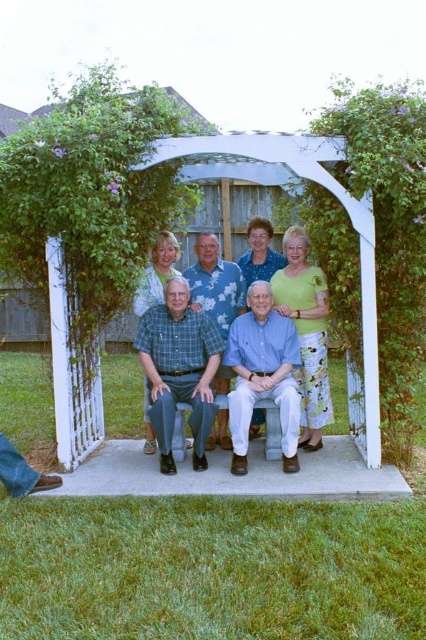
Is blue plaid shirt at center thinner than blue cotton shirt at center?

In fact, blue plaid shirt at center might be wider than blue cotton shirt at center.

Between blue plaid shirt at center and blue cotton shirt at center, which one appears on the right side from the viewer's perspective?

From the viewer's perspective, blue plaid shirt at center appears more on the right side.

Which is behind, point (250, 337) or point (232, 412)?

The point (250, 337) is more distant.

Where is `blue plaid shirt at center`? blue plaid shirt at center is located at coordinates (221, 285).

Is blue plaid shirt at center positioned before green checkered shirt at center?

No, blue plaid shirt at center is behind green checkered shirt at center.

Who is taller, blue plaid shirt at center or green checkered shirt at center?

blue plaid shirt at center

Does point (313, 404) lie behind point (186, 387)?

Yes.

Image resolution: width=426 pixels, height=640 pixels. In order to click on blue plaid shirt at center in this screenshot , I will do `click(221, 285)`.

Can you confirm if green checkered shirt at center is positioned below blue cotton shirt at center?

No.

Can you confirm if green checkered shirt at center is positioned above blue cotton shirt at center?

Yes, green checkered shirt at center is above blue cotton shirt at center.

Is point (166, 348) positioned in front of point (252, 404)?

No, it is behind (252, 404).

I want to click on green checkered shirt at center, so click(178, 369).